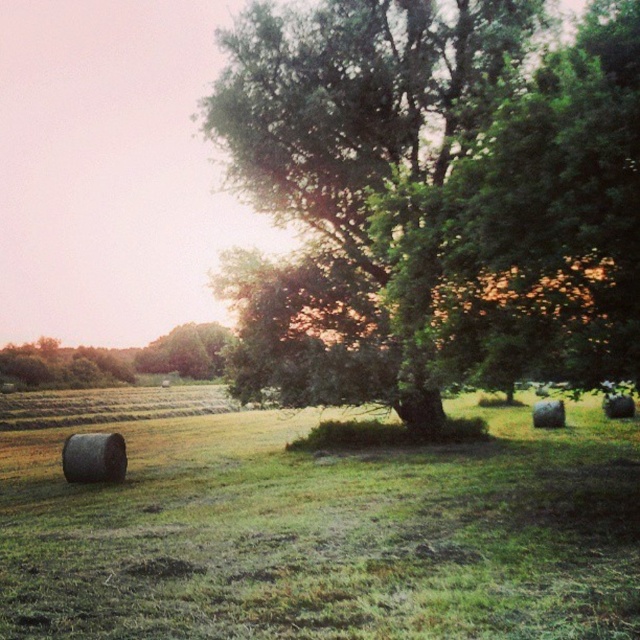
Question: Among these points, which one is nearest to the camera?

Choices:
 (A) 204,106
 (B) 88,536

Answer: (B)

Question: Can you confirm if green leafy tree at center is smaller than green grass at lower left?

Choices:
 (A) yes
 (B) no

Answer: (B)

Question: Which of the following is the closest to the observer?

Choices:
 (A) green grass at lower left
 (B) green leafy tree at center

Answer: (A)

Question: Does green leafy tree at center have a larger size compared to green grass at lower left?

Choices:
 (A) yes
 (B) no

Answer: (A)

Question: Is the position of green leafy tree at center less distant than that of green grass at lower left?

Choices:
 (A) yes
 (B) no

Answer: (B)